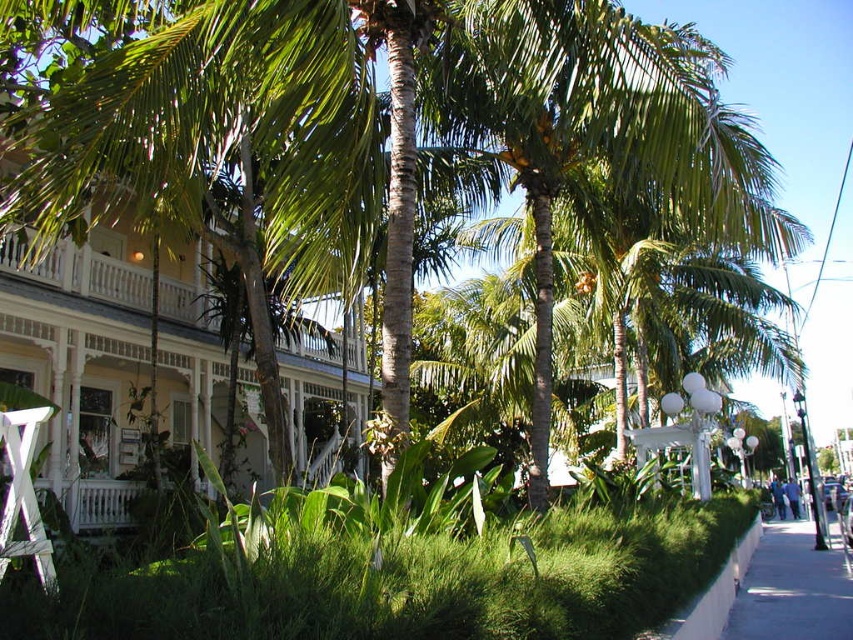
Question: Which object appears farthest from the camera in this image?

Choices:
 (A) white concrete curb at lower right
 (B) blue cotton shirt at lower right
 (C) blue fabric person at lower right

Answer: (C)

Question: Does gray concrete sidewalk at lower right appear over blue cotton shirt at lower right?

Choices:
 (A) yes
 (B) no

Answer: (A)

Question: Does blue fabric person at lower right have a larger size compared to blue cotton shirt at lower right?

Choices:
 (A) no
 (B) yes

Answer: (B)

Question: Which object is the closest to the white concrete curb at lower right?

Choices:
 (A) gray concrete sidewalk at lower right
 (B) green leafy grass at lower center
 (C) blue cotton shirt at lower right
 (D) blue fabric person at lower right

Answer: (A)

Question: Which object is closer to the camera taking this photo?

Choices:
 (A) green leafy grass at lower center
 (B) gray concrete sidewalk at lower right
 (C) blue fabric person at lower right
 (D) white concrete curb at lower right

Answer: (A)

Question: Is green leafy grass at lower center to the right of blue cotton shirt at lower right from the viewer's perspective?

Choices:
 (A) yes
 (B) no

Answer: (B)